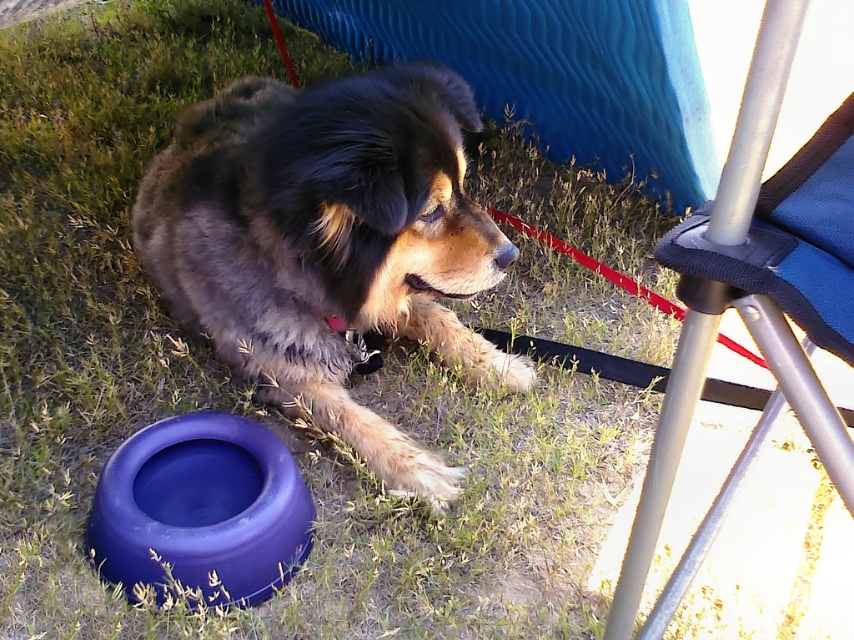
Can you confirm if fuzzy brown dog at center is positioned to the left of metallic silver folding chair at right?

Yes, fuzzy brown dog at center is to the left of metallic silver folding chair at right.

Based on the photo, is fuzzy brown dog at center to the right of metallic silver folding chair at right from the viewer's perspective?

A: Incorrect, fuzzy brown dog at center is not on the right side of metallic silver folding chair at right.

Does point (293, 412) lie in front of point (814, 412)?

That is False.

Identify the location of fuzzy brown dog at center. The width and height of the screenshot is (854, 640). (328, 243).